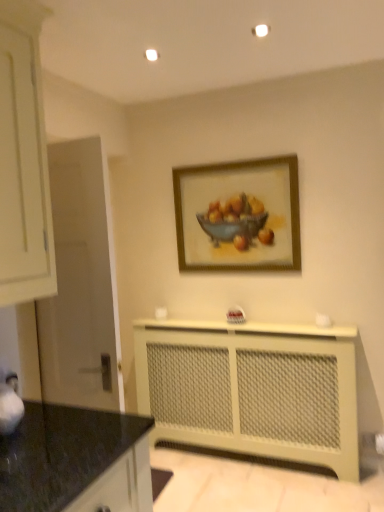
Find the location of a particular element. This screenshot has width=384, height=512. unoccupied area in front of beige mesh radiator at lower center is located at coordinates (251, 488).